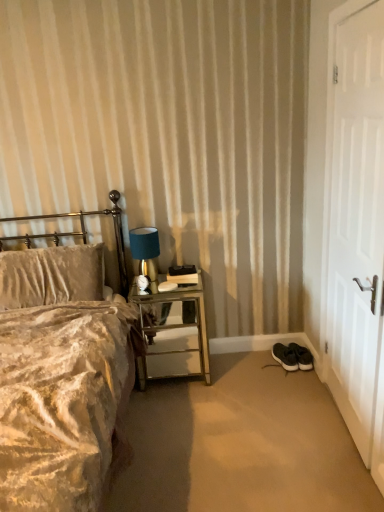
You are a GUI agent. You are given a task and a screenshot of the screen. Output one action in this format:
    pyautogui.click(x=<x>, y=<y>)
    Task: Click on the empty space that is in between mirrored glass nightstand at center and black suede sneakers at lower right, the 2th footwear in the right-to-left sequence
    The height and width of the screenshot is (512, 384).
    Given the screenshot: What is the action you would take?
    pyautogui.click(x=245, y=369)